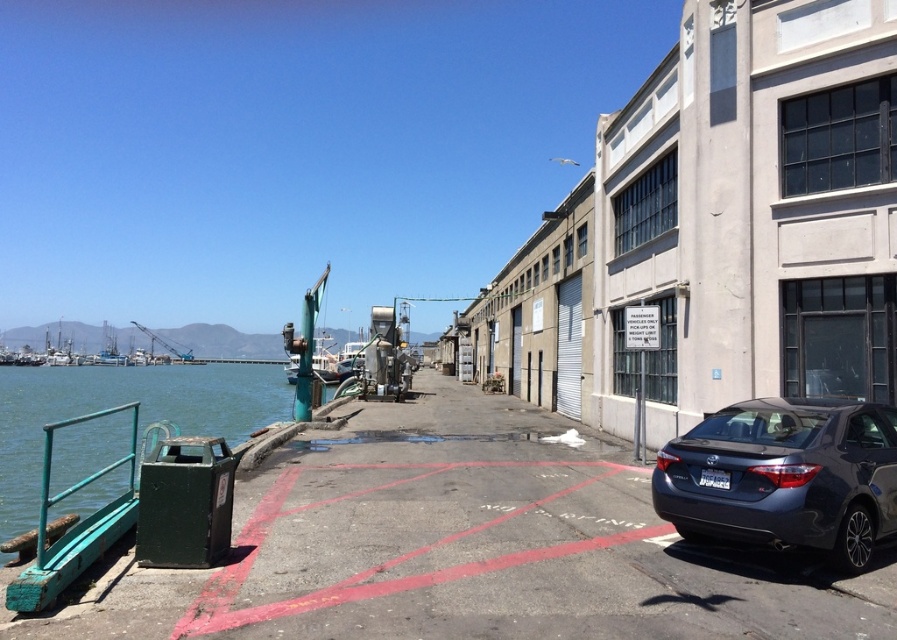
Is green metallic water at left shorter than green matte metal rail at lower left?

Incorrect, green metallic water at left's height does not fall short of green matte metal rail at lower left's.

Which is in front, point (23, 472) or point (40, 566)?

Point (40, 566) is in front.

This screenshot has width=897, height=640. What are the coordinates of `green metallic water at left` in the screenshot? It's located at (118, 404).

Is satin dark gray sedan at lower right in front of green metallic water at left?

Yes, satin dark gray sedan at lower right is in front of green metallic water at left.

Consider the image. Does satin dark gray sedan at lower right have a smaller size compared to green metallic water at left?

Correct, satin dark gray sedan at lower right occupies less space than green metallic water at left.

Is point (885, 474) positioned before point (0, 529)?

Yes, point (885, 474) is closer to viewer.

Find the location of a particular element. This screenshot has height=640, width=897. satin dark gray sedan at lower right is located at coordinates (784, 476).

Consider the image. Who is positioned more to the right, satin dark gray sedan at lower right or green matte metal rail at lower left?

From the viewer's perspective, satin dark gray sedan at lower right appears more on the right side.

Which of these two, satin dark gray sedan at lower right or green matte metal rail at lower left, stands shorter?

satin dark gray sedan at lower right is shorter.

Based on the photo, who is more distant from viewer, (665,496) or (94,557)?

The point (665,496) is more distant.

Where is `satin dark gray sedan at lower right`? satin dark gray sedan at lower right is located at coordinates (784, 476).